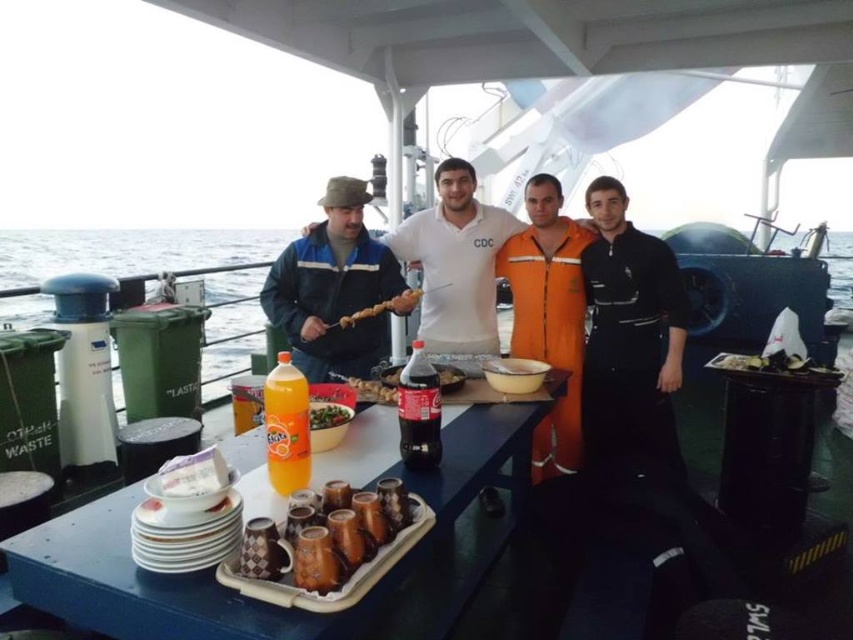
Is translucent plastic bottle at center positioned behind shiny silver tray at right?

No, translucent plastic bottle at center is closer to the viewer.

Between translucent plastic bottle at center and shiny silver tray at right, which one has more height?

With more height is translucent plastic bottle at center.

Is point (306, 432) positioned before point (790, 371)?

Yes, point (306, 432) is closer to viewer.

Locate an element on the screen. translucent plastic bottle at center is located at coordinates (286, 426).

Does shiny silver tray at right appear over smooth plastic bottle at center?

Yes.

Between shiny silver tray at right and smooth plastic bottle at center, which one appears on the right side from the viewer's perspective?

Positioned to the right is shiny silver tray at right.

At what (x,y) coordinates should I click in order to perform the action: click on shiny silver tray at right. Please return your answer as a coordinate pair (x, y). Looking at the image, I should click on (770, 364).

Image resolution: width=853 pixels, height=640 pixels. In order to click on shiny silver tray at right in this screenshot , I will do `click(770, 364)`.

Identify the location of shiny silver tray at right. The width and height of the screenshot is (853, 640). (770, 364).

Is shiny silver tray at right to the right of shiny plastic skewer at center from the viewer's perspective?

Yes, shiny silver tray at right is to the right of shiny plastic skewer at center.

The width and height of the screenshot is (853, 640). I want to click on shiny silver tray at right, so click(x=770, y=364).